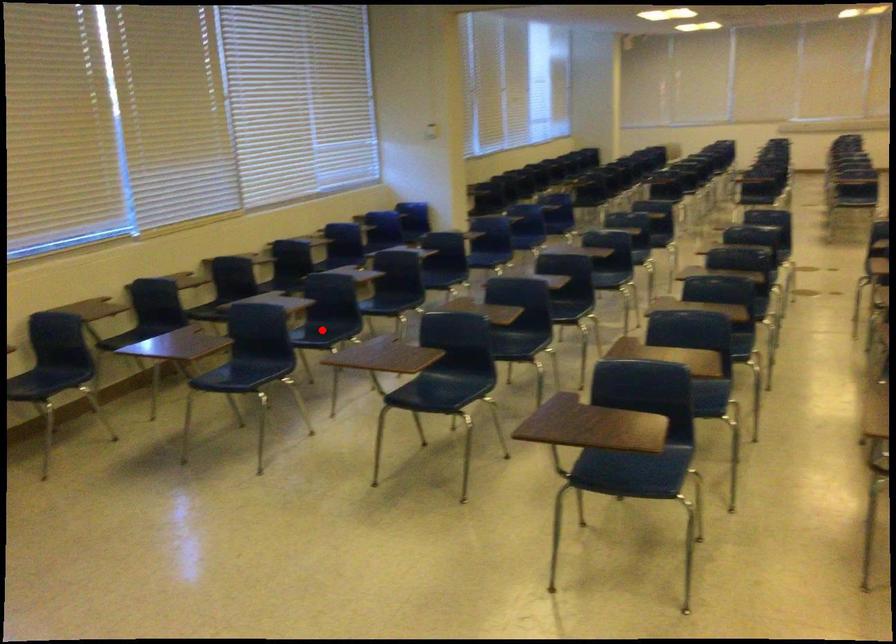
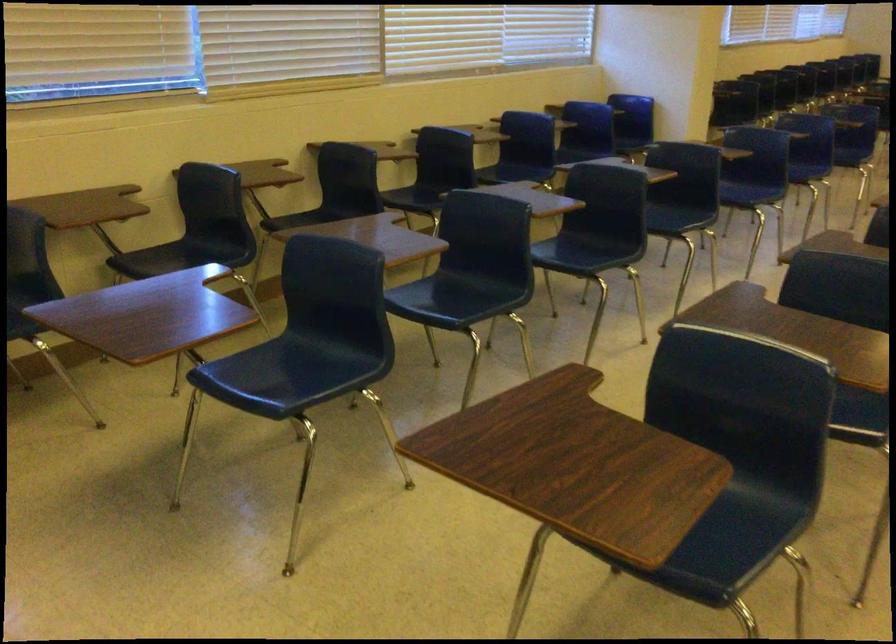
Question: I am providing you with two images of the same scene from different viewpoints. A red point is shown in image1. For the corresponding object point in image2, is it positioned nearer or farther from the camera?

Choices:
 (A) Nearer
 (B) Farther

Answer: (A)